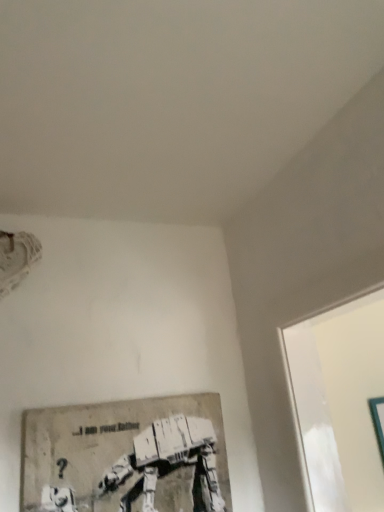
Question: Considering the relative sizes of teal glossy picture frame at right, the second picture frame viewed from the front, and matte gray poster at lower left, positioned as the second picture frame in back-to-front order, in the image provided, is teal glossy picture frame at right, the second picture frame viewed from the front, bigger than matte gray poster at lower left, positioned as the second picture frame in back-to-front order,?

Choices:
 (A) no
 (B) yes

Answer: (A)

Question: From the image's perspective, is teal glossy picture frame at right, the second picture frame viewed from the front, located above matte gray poster at lower left, which is counted as the first picture frame, starting from the front?

Choices:
 (A) no
 (B) yes

Answer: (A)

Question: Can you confirm if teal glossy picture frame at right, positioned as the first picture frame in right-to-left order, is thinner than matte gray poster at lower left, which is counted as the first picture frame, starting from the front?

Choices:
 (A) no
 (B) yes

Answer: (B)

Question: Is teal glossy picture frame at right, the second picture frame viewed from the front, to the left of matte gray poster at lower left, which is counted as the first picture frame, starting from the front, from the viewer's perspective?

Choices:
 (A) no
 (B) yes

Answer: (A)

Question: Is matte gray poster at lower left, which is counted as the first picture frame, starting from the front, inside teal glossy picture frame at right, the second picture frame viewed from the front?

Choices:
 (A) yes
 (B) no

Answer: (B)

Question: From a real-world perspective, is teal glossy picture frame at right, the second picture frame viewed from the front, under matte gray poster at lower left, which ranks as the first picture frame in left-to-right order?

Choices:
 (A) no
 (B) yes

Answer: (B)

Question: Does matte gray poster at lower left, which ranks as the first picture frame in left-to-right order, come in front of teal glossy picture frame at right, arranged as the second picture frame when viewed from the left?

Choices:
 (A) no
 (B) yes

Answer: (B)

Question: Can you confirm if matte gray poster at lower left, which is counted as the first picture frame, starting from the front, is taller than teal glossy picture frame at right, arranged as the second picture frame when viewed from the left?

Choices:
 (A) yes
 (B) no

Answer: (B)

Question: Considering the relative positions of matte gray poster at lower left, acting as the 2th picture frame starting from the right, and teal glossy picture frame at right, the second picture frame viewed from the front, in the image provided, is matte gray poster at lower left, acting as the 2th picture frame starting from the right, to the right of teal glossy picture frame at right, the second picture frame viewed from the front, from the viewer's perspective?

Choices:
 (A) yes
 (B) no

Answer: (B)

Question: Is matte gray poster at lower left, which is counted as the first picture frame, starting from the front, far from teal glossy picture frame at right, arranged as the second picture frame when viewed from the left?

Choices:
 (A) no
 (B) yes

Answer: (A)

Question: From the image's perspective, is matte gray poster at lower left, which ranks as the first picture frame in left-to-right order, located above teal glossy picture frame at right, positioned as the first picture frame in right-to-left order?

Choices:
 (A) no
 (B) yes

Answer: (B)

Question: Does matte gray poster at lower left, acting as the 2th picture frame starting from the right, have a lesser height compared to teal glossy picture frame at right, arranged as the second picture frame when viewed from the left?

Choices:
 (A) no
 (B) yes

Answer: (B)

Question: From a real-world perspective, relative to teal glossy picture frame at right, positioned as the first picture frame in right-to-left order, is matte gray poster at lower left, which ranks as the first picture frame in left-to-right order, vertically above or below?

Choices:
 (A) below
 (B) above

Answer: (B)